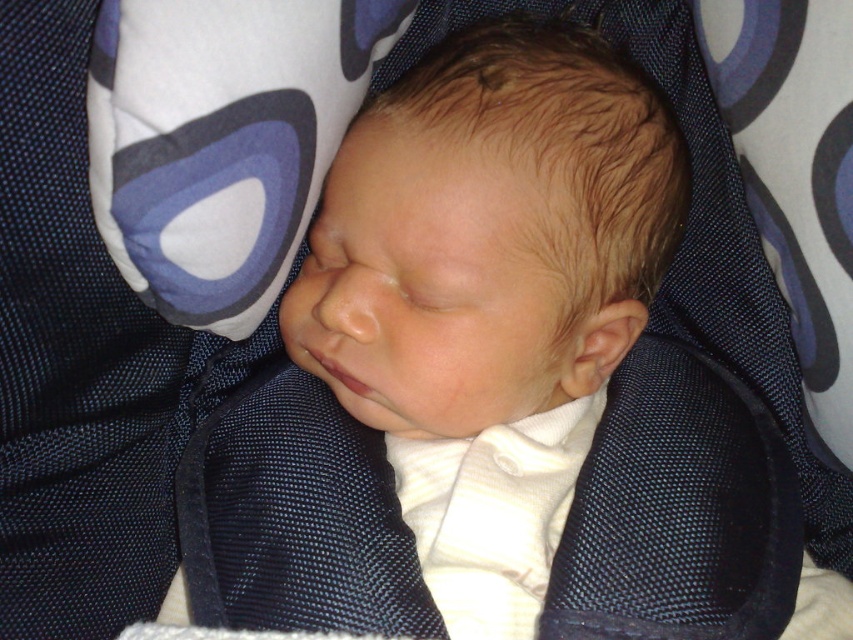
You are a photographer setting up a shoot with the smooth white baby at center and the white fabric pillow at upper center. You need to ensure the baby is the main focus. Based on their sizes, which object should you adjust your camera to prioritize?

The smooth white baby at center is larger in size than the white fabric pillow at upper center, so you should prioritize focusing on the smooth white baby at center to ensure it remains the main focus.

You are a photographer adjusting your camera to focus on two points in the image of a sleeping baby. The first point is at coordinates point (358, 120) and the second is at point (384, 4). Which point should you focus on first if you want to start with the closer one to ensure proper focus depth?

You should focus on point (358, 120) first because it is closer to the viewer than point (384, 4), allowing for better depth of field adjustment starting from the nearest point.

You are a photographer setting up for a baby photo shoot. You have a smooth white baby at center and a white fabric pillow at upper center in the frame. The baby needs to be positioned so that they fit comfortably within the space allocated for the shoot. Given that the baby is wider than the pillow, how should you adjust the baby or the pillow to ensure proper framing?

Since the smooth white baby at center is wider than the white fabric pillow at upper center, you should position the baby slightly to one side to allow enough space for both objects while maintaining the desired composition. Alternatively, you could move the pillow further away from the baby to create more room for the wider baby.